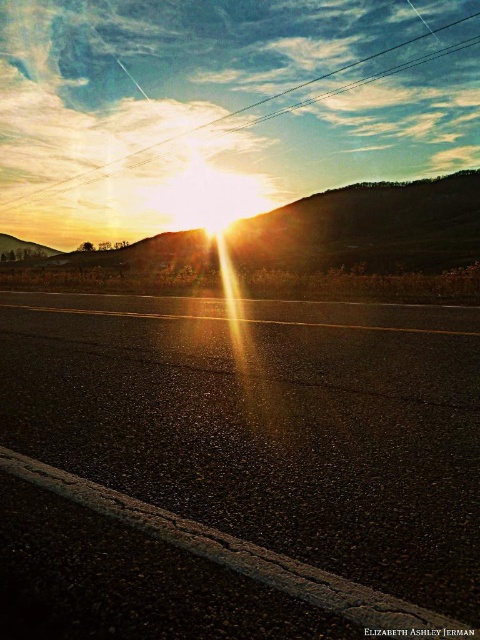
Question: Is black asphalt highway at center to the right of metallic wire at upper center from the viewer's perspective?

Choices:
 (A) yes
 (B) no

Answer: (B)

Question: Which point is farther to the camera?

Choices:
 (A) metallic wire at upper center
 (B) black asphalt highway at center

Answer: (A)

Question: Is black asphalt highway at center thinner than metallic wire at upper center?

Choices:
 (A) yes
 (B) no

Answer: (A)

Question: Among these points, which one is nearest to the camera?

Choices:
 (A) (334, 404)
 (B) (288, 88)

Answer: (A)

Question: Is the position of black asphalt highway at center more distant than that of metallic wire at upper center?

Choices:
 (A) yes
 (B) no

Answer: (B)